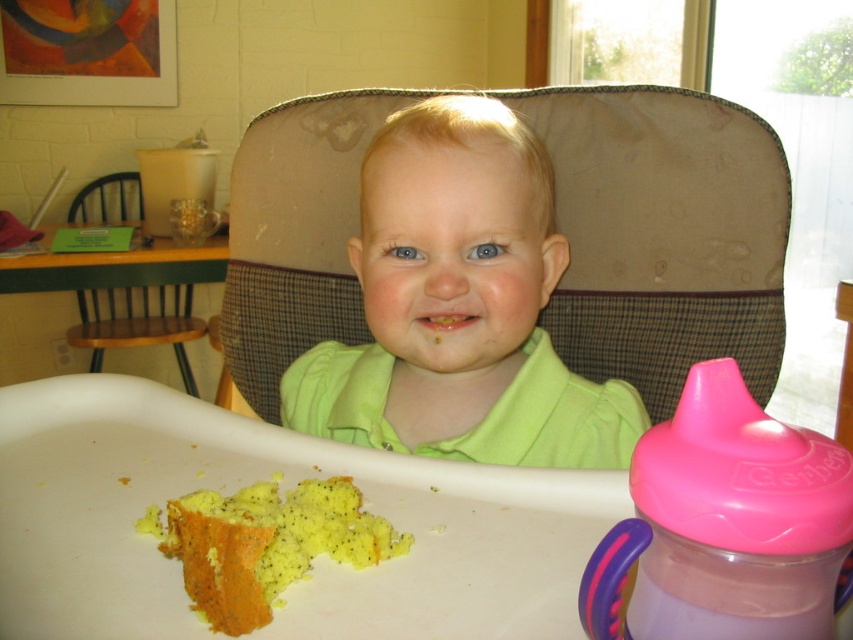
Question: Can you confirm if pink plastic sippy cup at right is bigger than wooden chair at left?

Choices:
 (A) no
 (B) yes

Answer: (A)

Question: Which object is the farthest from the yellow crumbly cake at lower left?

Choices:
 (A) wooden chair at left
 (B) green matte shirt at center
 (C) pink plastic sippy cup at right

Answer: (A)

Question: Can you confirm if pink plastic sippy cup at right is bigger than wooden chair at left?

Choices:
 (A) yes
 (B) no

Answer: (B)

Question: In this image, where is pink plastic sippy cup at right located relative to wooden chair at left?

Choices:
 (A) left
 (B) right

Answer: (B)

Question: Considering the real-world distances, which object is farthest from the pink plastic sippy cup at right?

Choices:
 (A) green matte shirt at center
 (B) yellow crumbly cake at lower left
 (C) wooden chair at left

Answer: (C)

Question: Which object is positioned farthest from the yellow crumbly cake at lower left?

Choices:
 (A) green matte shirt at center
 (B) wooden chair at left

Answer: (B)